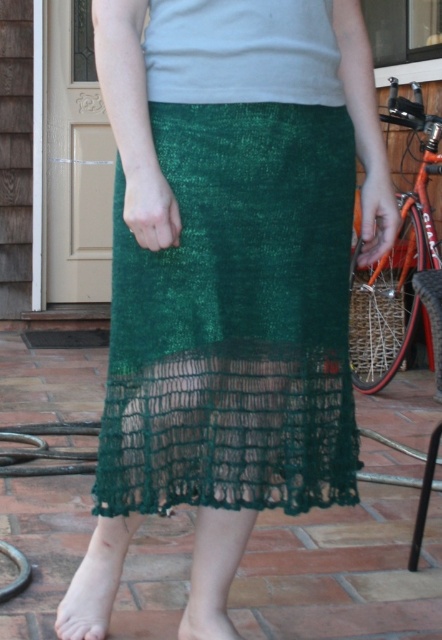
Question: Is green lace foot at lower center in front of green knitted sock at lower center?

Choices:
 (A) yes
 (B) no

Answer: (B)

Question: Which point is farther to the camera?

Choices:
 (A) (121, 557)
 (B) (260, 634)

Answer: (B)

Question: Can you confirm if green lace foot at lower center is smaller than green knitted sock at lower center?

Choices:
 (A) yes
 (B) no

Answer: (A)

Question: Among these objects, which one is farthest from the camera?

Choices:
 (A) green lace foot at lower center
 (B) green knitted sock at lower center

Answer: (A)

Question: Which point is farther to the camera?

Choices:
 (A) (75, 612)
 (B) (217, 616)

Answer: (A)

Question: Does green lace foot at lower center appear on the left side of green knitted sock at lower center?

Choices:
 (A) yes
 (B) no

Answer: (A)